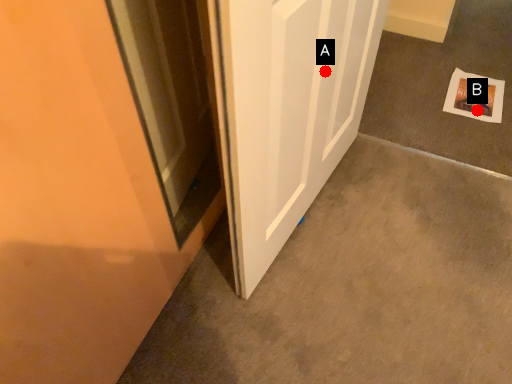
Question: Two points are circled on the image, labeled by A and B beside each circle. Which point is further to the camera?

Choices:
 (A) A is further
 (B) B is further

Answer: (B)